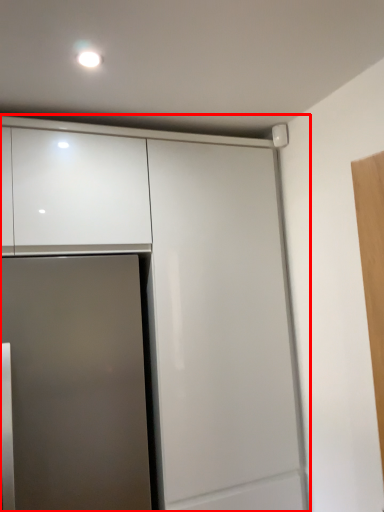
Question: From the image's perspective, what is the correct spatial relationship of cabinetry (annotated by the red box) in relation to door?

Choices:
 (A) below
 (B) above

Answer: (B)